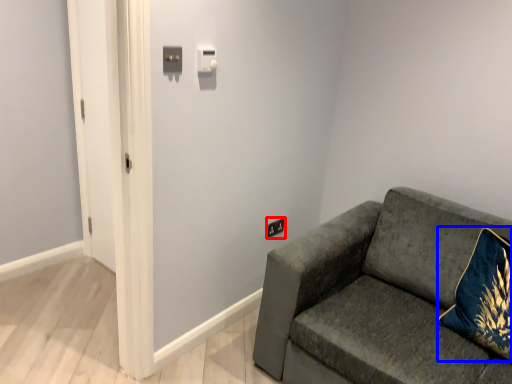
Question: Which point is further to the camera, electric outlet (highlighted by a red box) or throw pillow (highlighted by a blue box)?

Choices:
 (A) electric outlet
 (B) throw pillow

Answer: (A)